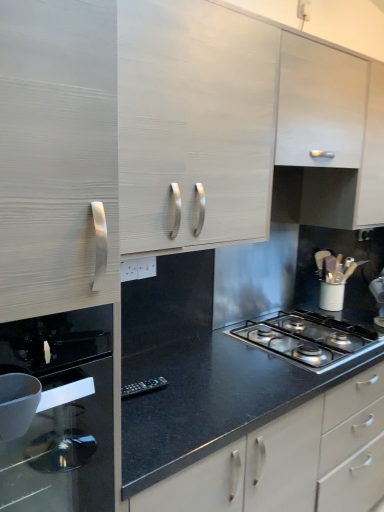
Question: From a real-world perspective, relative to polished stainless steel gas stove at center, is matte white cabinet at upper left, which ranks as the first cabinetry in left-to-right order, vertically above or below?

Choices:
 (A) below
 (B) above

Answer: (B)

Question: Would you say matte white cabinet at upper left, which ranks as the second cabinetry in right-to-left order, is to the left or to the right of polished stainless steel gas stove at center in the picture?

Choices:
 (A) right
 (B) left

Answer: (B)

Question: Which of these objects is positioned closest to the matte white cabinet at upper left, which ranks as the first cabinetry in left-to-right order?

Choices:
 (A) white matte utensil holder at right
 (B) black glass oven at left
 (C) polished stainless steel gas stove at center
 (D) white wood cabinet at upper center, the 1th cabinetry in the right-to-left sequence

Answer: (D)

Question: Which object is the farthest from the black glass oven at left?

Choices:
 (A) matte white cabinet at upper left, which ranks as the first cabinetry in left-to-right order
 (B) polished stainless steel gas stove at center
 (C) white wood cabinet at upper center, the 1th cabinetry in the right-to-left sequence
 (D) white matte utensil holder at right

Answer: (D)